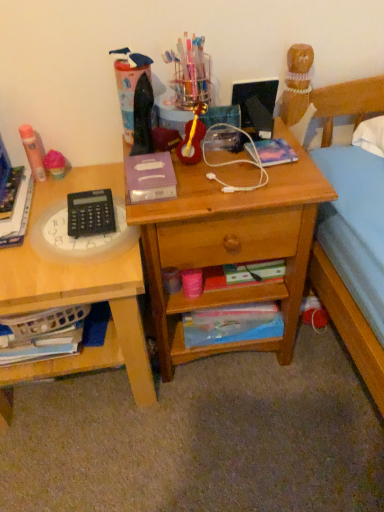
Where is `vacant area that lies between multicolored fabric book at center, the 1th paperback book positioned from the top, and white matte earphones at center`? vacant area that lies between multicolored fabric book at center, the 1th paperback book positioned from the top, and white matte earphones at center is located at coordinates 247,160.